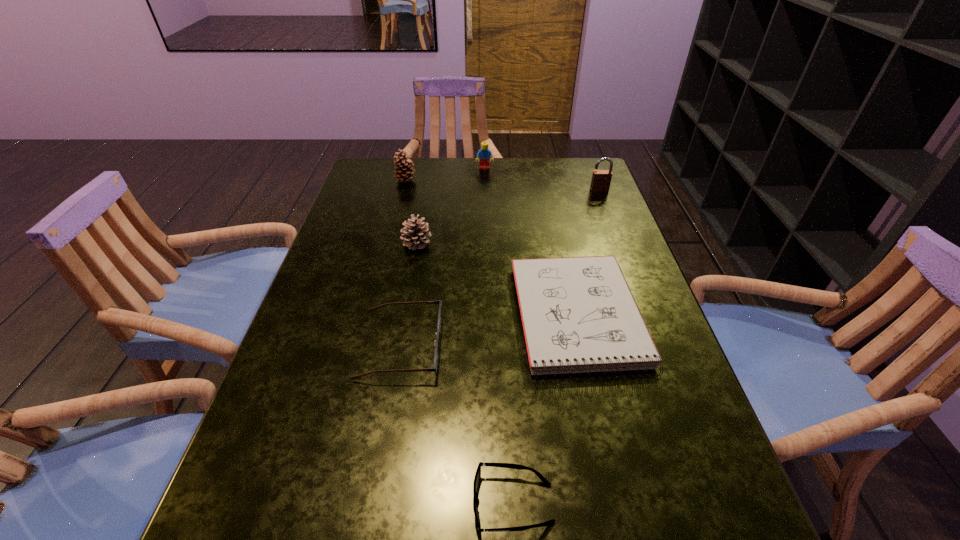
At what (x,y) coordinates should I click in order to perform the action: click on free space that is in between the notepad and the spectacles. Please return your answer as a coordinate pair (x, y). The image size is (960, 540). Looking at the image, I should click on (489, 330).

Identify the location of free space between the third farthest object and the taller pinecone. The height and width of the screenshot is (540, 960). (502, 185).

Locate which object is the fifth closest to the spectacles. Please provide its 2D coordinates. Your answer should be formatted as a tuple, i.e. [(x, y)], where the tuple contains the x and y coordinates of a point satisfying the conditions above.

[(484, 154)]

The height and width of the screenshot is (540, 960). In order to click on object that ranks as the sixth closest to the nearest object in this screenshot , I will do `click(484, 154)`.

Find the location of a particular element. This screenshot has height=540, width=960. free point that satisfies the following two spatial constraints: 1. on the front side of the taller pinecone; 2. on the left side of the fourth farthest object is located at coordinates (390, 244).

Identify the location of vacant area in the image that satisfies the following two spatial constraints: 1. on the front side of the notepad; 2. on the front-facing side of the spectacles. (584, 345).